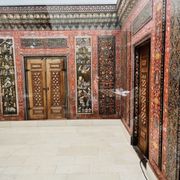
Identify the location of doors. (38, 96), (54, 100), (143, 117).